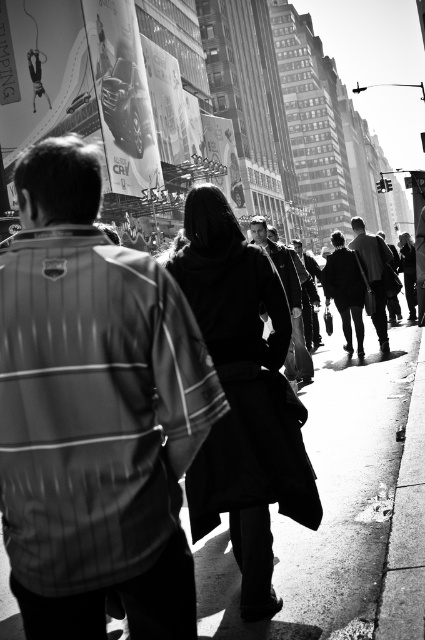
You are standing at point (x=235, y=182) and want to walk to the sidewalk ahead. Is there a clear path to point (x=164, y=308) without obstacles?

Yes, there is a clear path to point (x=164, y=308) because it is in front of your current position at point (x=235, y=182), so you can walk straight ahead.